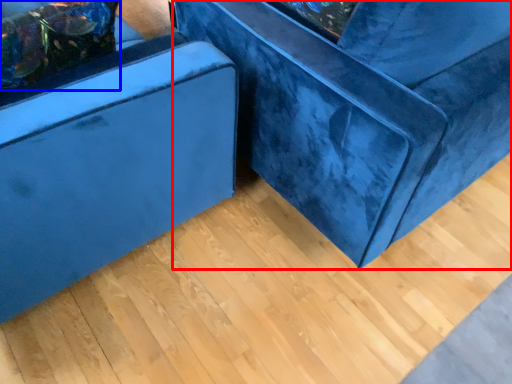
Question: Which point is closer to the camera, furniture (highlighted by a red box) or pillow (highlighted by a blue box)?

Choices:
 (A) furniture
 (B) pillow

Answer: (A)